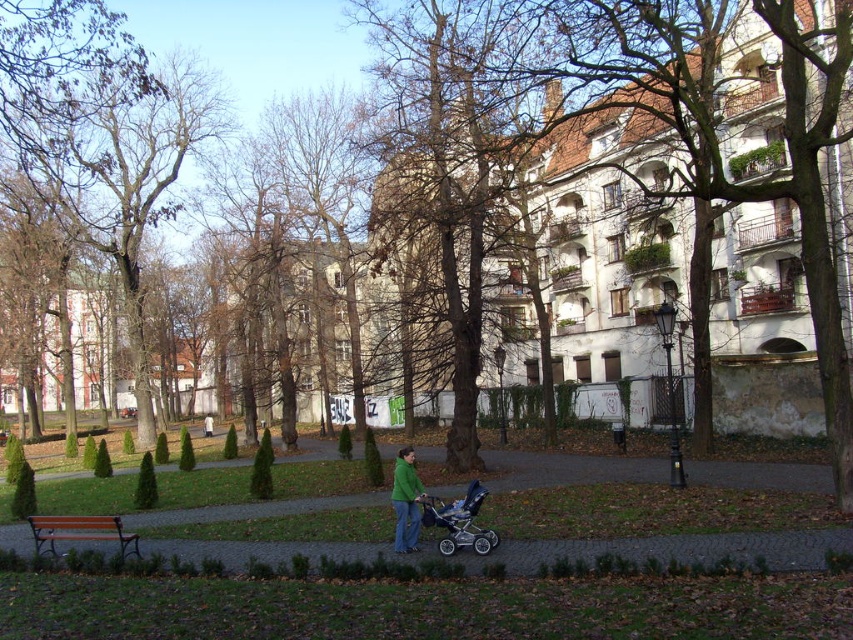
Question: Where is brown rough bark tree at center located in relation to brown leafless tree at upper left in the image?

Choices:
 (A) below
 (B) above

Answer: (B)

Question: Among these objects, which one is nearest to the camera?

Choices:
 (A) orange painted wood bench at lower left
 (B) brown leafless tree at upper left
 (C) green matte jacket at center

Answer: (A)

Question: Which object is closer to the camera taking this photo?

Choices:
 (A) green matte jacket at center
 (B) brown leafless tree at upper left
 (C) brown paved path at lower center
 (D) silver metallic stroller at center

Answer: (C)

Question: Which of the following is the farthest from the observer?

Choices:
 (A) (134, 550)
 (B) (486, 550)
 (C) (556, 556)
 (D) (416, 548)

Answer: (A)

Question: Does brown paved path at lower center appear on the right side of silver metallic stroller at center?

Choices:
 (A) no
 (B) yes

Answer: (A)

Question: Does brown rough bark tree at center appear over silver metallic stroller at center?

Choices:
 (A) no
 (B) yes

Answer: (B)